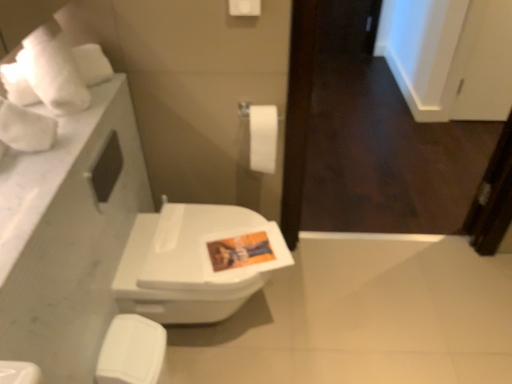
Question: Does white glossy toilet seat at lower left turn towards white matte toilet paper at center?

Choices:
 (A) no
 (B) yes

Answer: (A)

Question: Is white glossy toilet seat at lower left far away from white matte toilet paper at center?

Choices:
 (A) no
 (B) yes

Answer: (A)

Question: Does white glossy toilet seat at lower left have a greater height compared to white matte toilet paper at center?

Choices:
 (A) yes
 (B) no

Answer: (A)

Question: From the image's perspective, does white glossy toilet seat at lower left appear lower than white matte toilet paper at center?

Choices:
 (A) no
 (B) yes

Answer: (B)

Question: From the image's perspective, would you say white glossy toilet seat at lower left is positioned over white matte toilet paper at center?

Choices:
 (A) no
 (B) yes

Answer: (A)

Question: In terms of size, does white glossy toilet at center appear bigger or smaller than white marble countertop at left?

Choices:
 (A) big
 (B) small

Answer: (A)

Question: From the image's perspective, relative to white marble countertop at left, is white glossy toilet at center above or below?

Choices:
 (A) above
 (B) below

Answer: (B)

Question: From a real-world perspective, is white glossy toilet at center above or below white marble countertop at left?

Choices:
 (A) above
 (B) below

Answer: (B)

Question: Is white glossy toilet at center in front of or behind white marble countertop at left in the image?

Choices:
 (A) front
 (B) behind

Answer: (B)

Question: From the image's perspective, is white matte toilet paper at center above or below white marble countertop at left?

Choices:
 (A) below
 (B) above

Answer: (B)

Question: Considering the positions of white matte toilet paper at center and white marble countertop at left in the image, is white matte toilet paper at center taller or shorter than white marble countertop at left?

Choices:
 (A) tall
 (B) short

Answer: (A)

Question: In terms of size, does white matte toilet paper at center appear bigger or smaller than white marble countertop at left?

Choices:
 (A) big
 (B) small

Answer: (B)

Question: From a real-world perspective, is white matte toilet paper at center positioned above or below white marble countertop at left?

Choices:
 (A) below
 (B) above

Answer: (A)

Question: Is white matte toilet paper at center wider or thinner than white glossy toilet seat at lower left?

Choices:
 (A) thin
 (B) wide

Answer: (A)

Question: Is point (273, 142) closer or farther from the camera than point (138, 362)?

Choices:
 (A) closer
 (B) farther

Answer: (B)